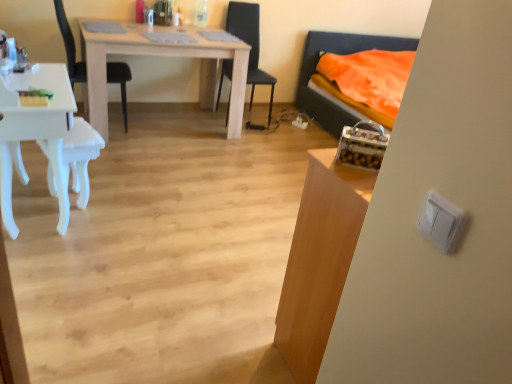
Image resolution: width=512 pixels, height=384 pixels. Find the location of `vacant space to the right of light wood table at center, which appears as the first table when viewed from the left`. vacant space to the right of light wood table at center, which appears as the first table when viewed from the left is located at coordinates (273, 150).